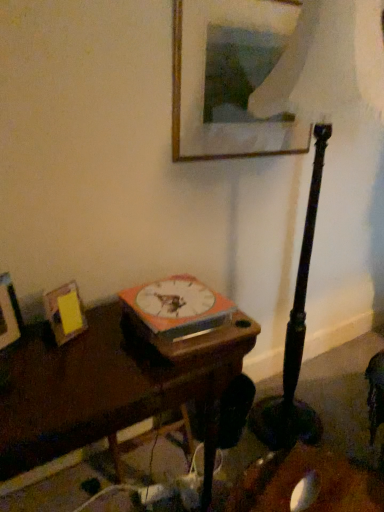
Question: Is matte black lamp at center shorter than yellow paper at left, which is the 2th picture frame in left-to-right order?

Choices:
 (A) no
 (B) yes

Answer: (A)

Question: Is matte black lamp at center positioned behind yellow paper at left, the second picture frame when ordered from top to bottom?

Choices:
 (A) no
 (B) yes

Answer: (A)

Question: Is matte black lamp at center with yellow paper at left, the second picture frame when ordered from top to bottom?

Choices:
 (A) no
 (B) yes

Answer: (A)

Question: From a real-world perspective, is matte black lamp at center under yellow paper at left, the second picture frame when ordered from top to bottom?

Choices:
 (A) yes
 (B) no

Answer: (B)

Question: Does matte black lamp at center appear on the left side of yellow paper at left, the 2th picture frame viewed from the right?

Choices:
 (A) no
 (B) yes

Answer: (A)

Question: Is matte black lamp at center positioned with its back to yellow paper at left, which is the 2th picture frame in left-to-right order?

Choices:
 (A) no
 (B) yes

Answer: (A)

Question: From the image's perspective, is dark wood table at center beneath wooden photo frame at left, the third picture frame in the top-to-bottom sequence?

Choices:
 (A) no
 (B) yes

Answer: (B)

Question: Is dark wood table at center bigger than wooden photo frame at left, the third picture frame from the right?

Choices:
 (A) yes
 (B) no

Answer: (A)

Question: Can you confirm if dark wood table at center is taller than wooden photo frame at left, the third picture frame from the right?

Choices:
 (A) yes
 (B) no

Answer: (A)

Question: Can you confirm if dark wood table at center is thinner than wooden photo frame at left, the third picture frame from the right?

Choices:
 (A) yes
 (B) no

Answer: (B)

Question: Is dark wood table at center to the right of wooden photo frame at left, the third picture frame from the right, from the viewer's perspective?

Choices:
 (A) no
 (B) yes

Answer: (B)

Question: From a real-world perspective, is dark wood table at center located beneath wooden photo frame at left, the first picture frame in the left-to-right sequence?

Choices:
 (A) no
 (B) yes

Answer: (B)

Question: From the image's perspective, does wooden picture frame at upper center, the third picture frame when ordered from left to right, appear lower than orange matte book at center?

Choices:
 (A) no
 (B) yes

Answer: (A)